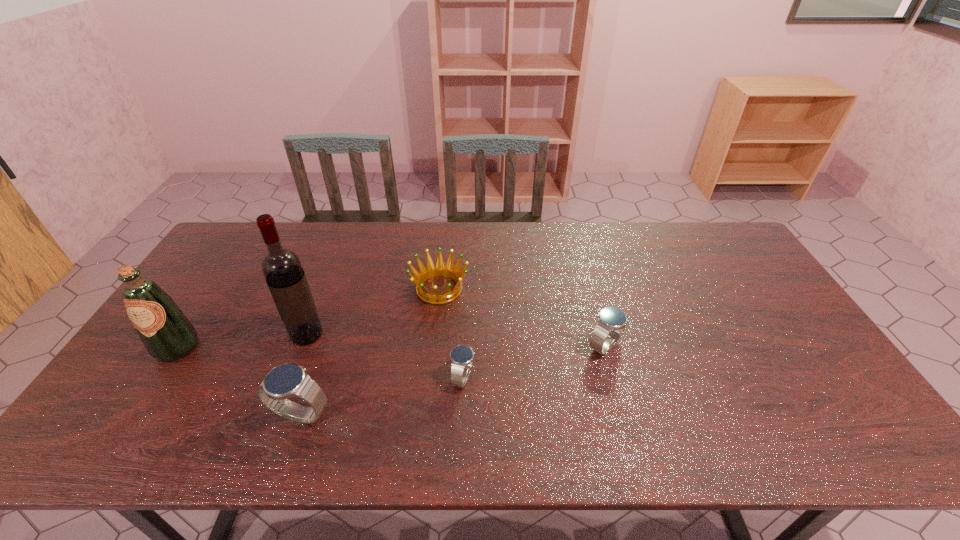
Point out which object is positioned as the second nearest to the crown. Please provide its 2D coordinates. Your answer should be formatted as a tuple, i.e. [(x, y)], where the tuple contains the x and y coordinates of a point satisfying the conditions above.

[(282, 269)]

Locate which watch is the second closest to the nearest object. Please provide its 2D coordinates. Your answer should be formatted as a tuple, i.e. [(x, y)], where the tuple contains the x and y coordinates of a point satisfying the conditions above.

[(611, 323)]

The width and height of the screenshot is (960, 540). What are the coordinates of `watch object that ranks as the third closest to the crown` in the screenshot? It's located at (611, 323).

Locate an element on the screen. The width and height of the screenshot is (960, 540). free space that satisfies the following two spatial constraints: 1. on the back side of the tallest watch; 2. on the right side of the rightmost watch is located at coordinates (324, 346).